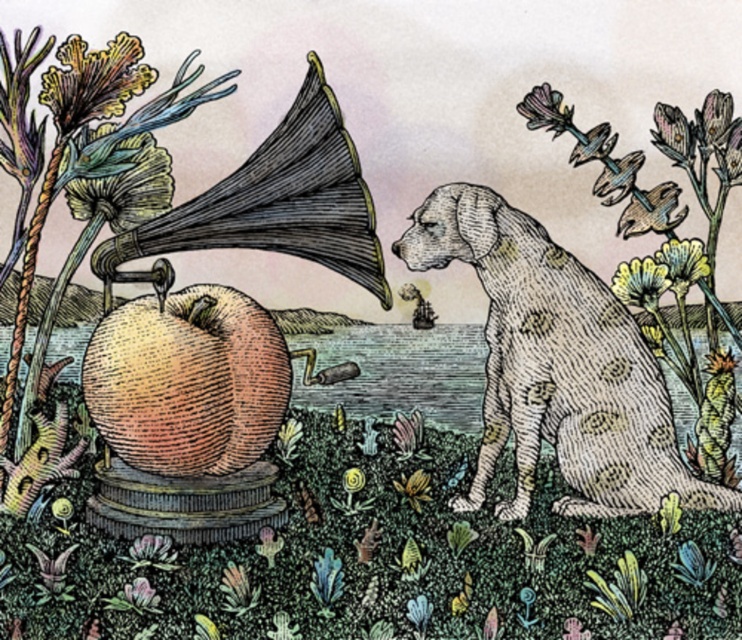
You are an artist trying to paint the scene depicted in the image. You need to place the pastel yellow petals at upper right accurately. According to the coordinates provided, where should you position them on your canvas?

→ The pastel yellow petals at upper right should be positioned at coordinates point (x=682, y=262) on the canvas.

You are an artist painting this scene and want to add a new element between the pastel yellow petals at upper right and the matte purple flower at upper right. Which flower should you place the new element closer to?

The new element should be placed closer to the matte purple flower at upper right because the pastel yellow petals at upper right are positioned under it, meaning the matte purple flower is above.

You are a photographer standing at the camera position. You want to take a closeup shot of the pastel yellow petals at upper right. Can you reach the petals with your camera without moving your position? The camera has a zoom lens with a maximum zoom range of 1.2 meters.

The distance between the pastel yellow petals at upper right and the camera is 1.32 meters. Since the camera can only zoom up to 1.2 meters, you cannot reach the petals with the current zoom setting. You need to move closer or use a longer zoom lens.